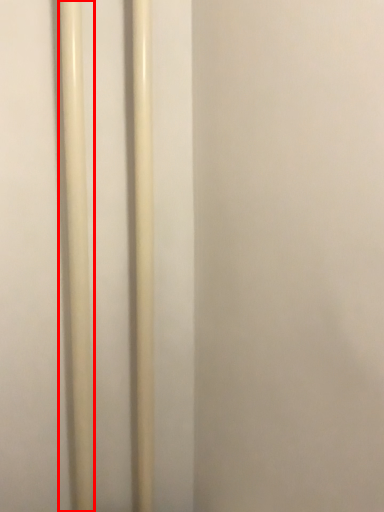
Question: From the image's perspective, considering the relative positions of pole (annotated by the red box) and pole in the image provided, where is pole (annotated by the red box) located with respect to the staircase?

Choices:
 (A) below
 (B) above

Answer: (A)